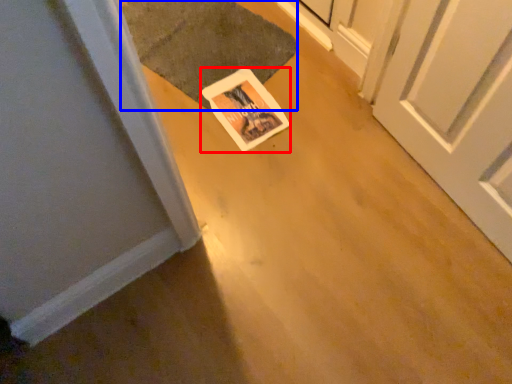
Question: Which point is closer to the camera, postcard (highlighted by a red box) or doormat (highlighted by a blue box)?

Choices:
 (A) postcard
 (B) doormat

Answer: (A)